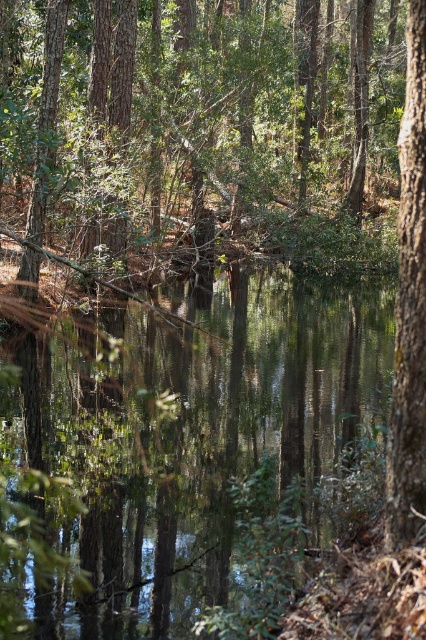
Between point (126, 38) and point (422, 44), which one is positioned in front?

Point (422, 44) is in front.

Does brown rough tree at center appear on the right side of smooth bark tree at right?

Incorrect, brown rough tree at center is not on the right side of smooth bark tree at right.

Who is more distant from viewer, (227,97) or (403,426)?

Positioned behind is point (227,97).

Locate an element on the screen. The height and width of the screenshot is (640, 426). brown rough tree at center is located at coordinates (203, 132).

Can you confirm if brown rough tree at center is bigger than clear water at center?

Indeed, brown rough tree at center has a larger size compared to clear water at center.

Does point (203, 202) come closer to viewer compared to point (374, 349)?

No, it is behind (374, 349).

The image size is (426, 640). Identify the location of brown rough tree at center. (203, 132).

Is clear water at center shorter than smooth bark tree at right?

No.

Which of these two, clear water at center or smooth bark tree at right, stands shorter?

smooth bark tree at right

What do you see at coordinates (189, 432) in the screenshot? I see `clear water at center` at bounding box center [189, 432].

The width and height of the screenshot is (426, 640). What are the coordinates of `clear water at center` in the screenshot? It's located at (189, 432).